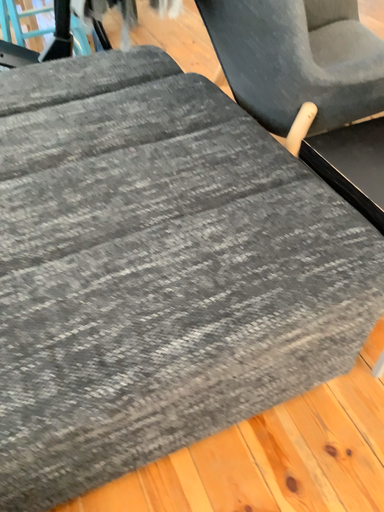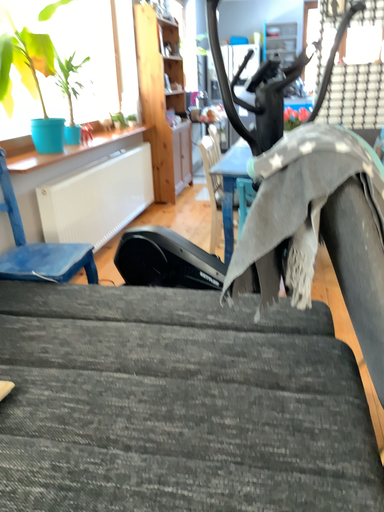
Question: Which way did the camera rotate in the video?

Choices:
 (A) rotated upward
 (B) rotated downward

Answer: (A)